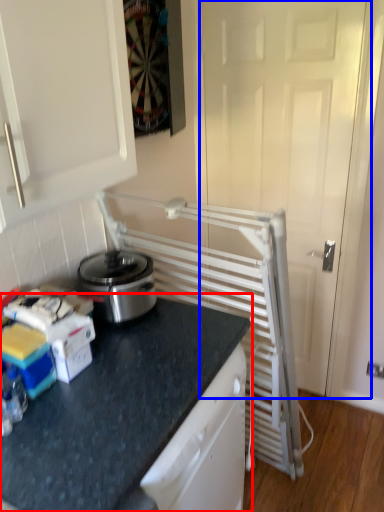
Question: Which point is further to the camera, countertop (highlighted by a red box) or screen door (highlighted by a blue box)?

Choices:
 (A) countertop
 (B) screen door

Answer: (B)